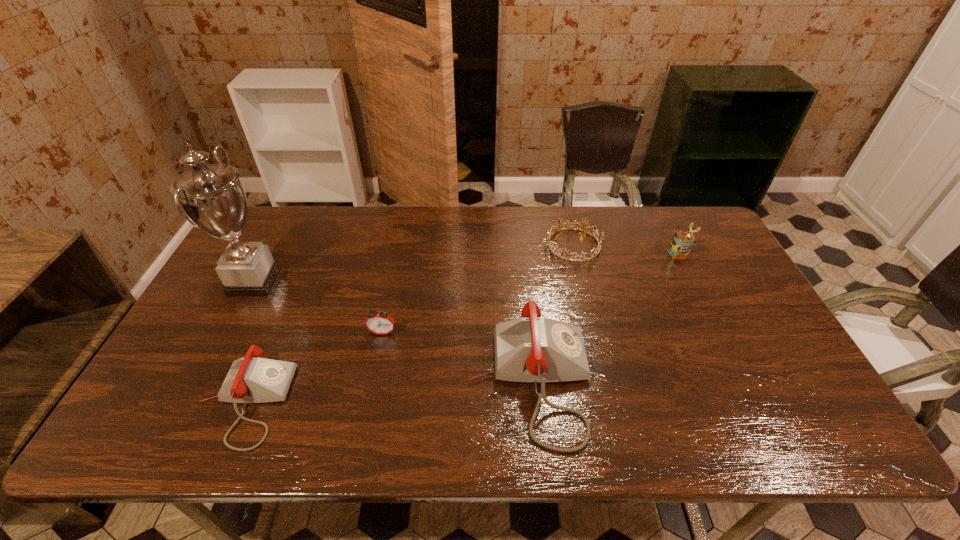
Locate an element on the screen. The width and height of the screenshot is (960, 540). free location that satisfies the following two spatial constraints: 1. on the front-facing side of the rightmost object; 2. on the left side of the shortest object is located at coordinates (575, 253).

Where is `vacant area that satisfies the following two spatial constraints: 1. on the front-facing side of the tiara; 2. on the back side of the can`? vacant area that satisfies the following two spatial constraints: 1. on the front-facing side of the tiara; 2. on the back side of the can is located at coordinates (575, 253).